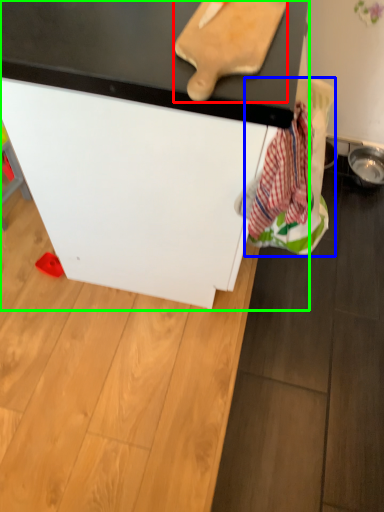
Question: Which object is the closest to the cutting board (highlighted by a red box)? Choose among these: laundry (highlighted by a blue box) or furniture (highlighted by a green box).

Choices:
 (A) laundry
 (B) furniture

Answer: (B)